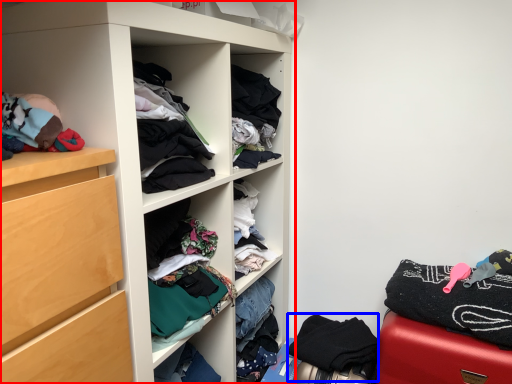
Question: Which point is closer to the camera, cupboard (highlighted by a red box) or clothing (highlighted by a blue box)?

Choices:
 (A) cupboard
 (B) clothing

Answer: (A)